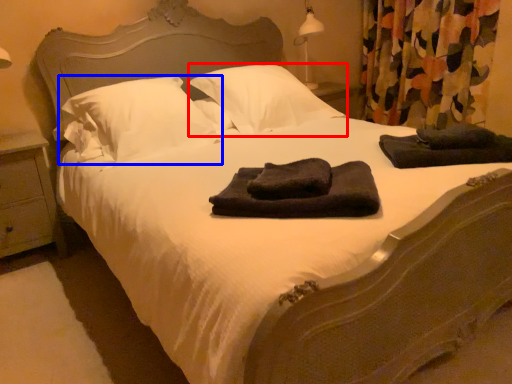
Question: Among these objects, which one is farthest to the camera, pillow (highlighted by a red box) or pillow (highlighted by a blue box)?

Choices:
 (A) pillow
 (B) pillow

Answer: (A)